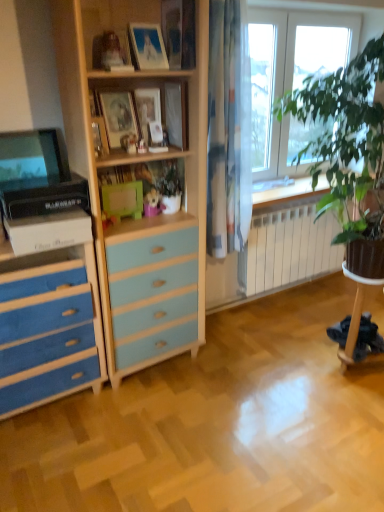
Question: Should I look upward or downward to see blue painted wood chest of drawers at left?

Choices:
 (A) up
 (B) down

Answer: (B)

Question: Is matte wooden picture frame at center, which is counted as the 1th picture frame, starting from the back, aimed at matte glass picture frame at upper center, which ranks as the third picture frame in back-to-front order?

Choices:
 (A) no
 (B) yes

Answer: (A)

Question: Is matte wooden picture frame at center, which ranks as the 3th picture frame in front-to-back order, taller than matte glass picture frame at upper center, which ranks as the 1th picture frame in front-to-back order?

Choices:
 (A) yes
 (B) no

Answer: (A)

Question: Considering the relative sizes of matte wooden picture frame at center, which ranks as the 3th picture frame in front-to-back order, and matte glass picture frame at upper center, which ranks as the 1th picture frame in front-to-back order, in the image provided, is matte wooden picture frame at center, which ranks as the 3th picture frame in front-to-back order, thinner than matte glass picture frame at upper center, which ranks as the 1th picture frame in front-to-back order,?

Choices:
 (A) no
 (B) yes

Answer: (B)

Question: Would you say matte glass picture frame at upper center, which ranks as the third picture frame in back-to-front order, is part of matte wooden picture frame at center, which is counted as the 1th picture frame, starting from the back,'s contents?

Choices:
 (A) no
 (B) yes

Answer: (A)

Question: Is the surface of matte wooden picture frame at center, which ranks as the 3th picture frame in front-to-back order, in direct contact with matte glass picture frame at upper center, which ranks as the third picture frame in back-to-front order?

Choices:
 (A) yes
 (B) no

Answer: (B)

Question: From the image's perspective, would you say matte wooden picture frame at center, which is counted as the 1th picture frame, starting from the back, is positioned over matte glass picture frame at upper center, which ranks as the 1th picture frame in front-to-back order?

Choices:
 (A) no
 (B) yes

Answer: (A)

Question: From a real-world perspective, is white metallic radiator at lower right located higher than matte wooden picture frame at center, which ranks as the 3th picture frame in front-to-back order?

Choices:
 (A) no
 (B) yes

Answer: (A)

Question: Considering the relative sizes of white metallic radiator at lower right and matte wooden picture frame at center, which ranks as the 3th picture frame in front-to-back order, in the image provided, is white metallic radiator at lower right taller than matte wooden picture frame at center, which ranks as the 3th picture frame in front-to-back order,?

Choices:
 (A) no
 (B) yes

Answer: (B)

Question: From the image's perspective, is white metallic radiator at lower right above matte wooden picture frame at center, which ranks as the 3th picture frame in front-to-back order?

Choices:
 (A) yes
 (B) no

Answer: (B)

Question: Is white metallic radiator at lower right at the right side of matte wooden picture frame at center, which is counted as the 1th picture frame, starting from the back?

Choices:
 (A) yes
 (B) no

Answer: (A)

Question: Is white metallic radiator at lower right looking in the opposite direction of matte wooden picture frame at center, which is counted as the 1th picture frame, starting from the back?

Choices:
 (A) yes
 (B) no

Answer: (B)

Question: Considering the relative sizes of white metallic radiator at lower right and matte wooden picture frame at center, which is counted as the 1th picture frame, starting from the back, in the image provided, is white metallic radiator at lower right shorter than matte wooden picture frame at center, which is counted as the 1th picture frame, starting from the back,?

Choices:
 (A) yes
 (B) no

Answer: (B)

Question: From a real-world perspective, is matte black monitor at left over blue painted wood chest of drawers at left?

Choices:
 (A) yes
 (B) no

Answer: (A)